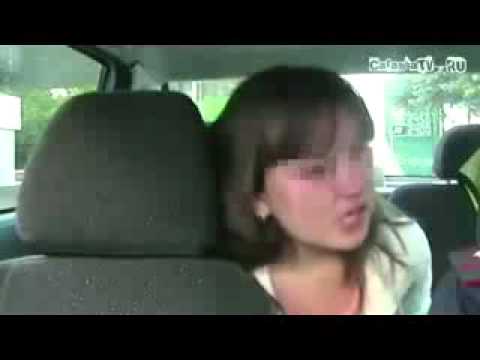
Locate an element on the screen. The height and width of the screenshot is (360, 480). window is located at coordinates (18, 73), (205, 92).